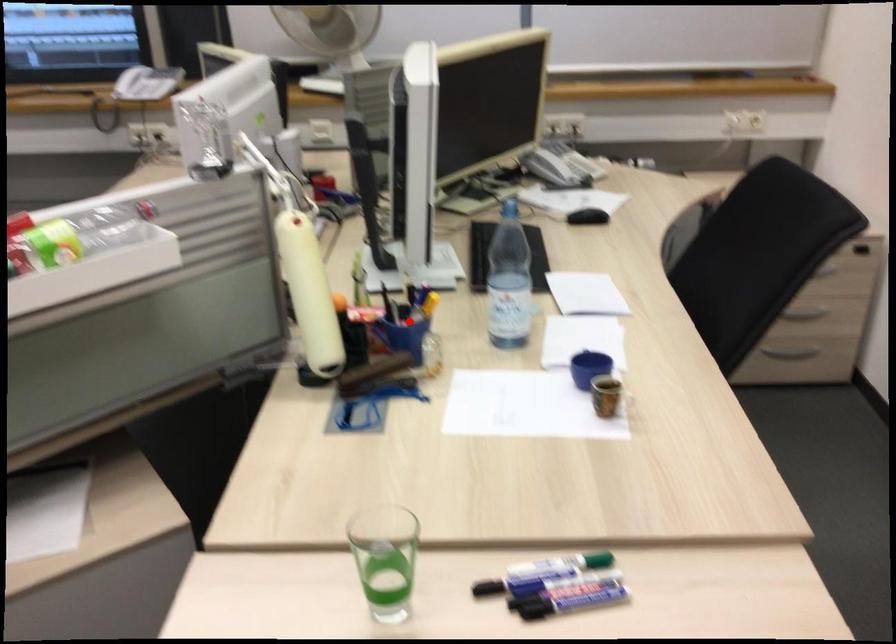
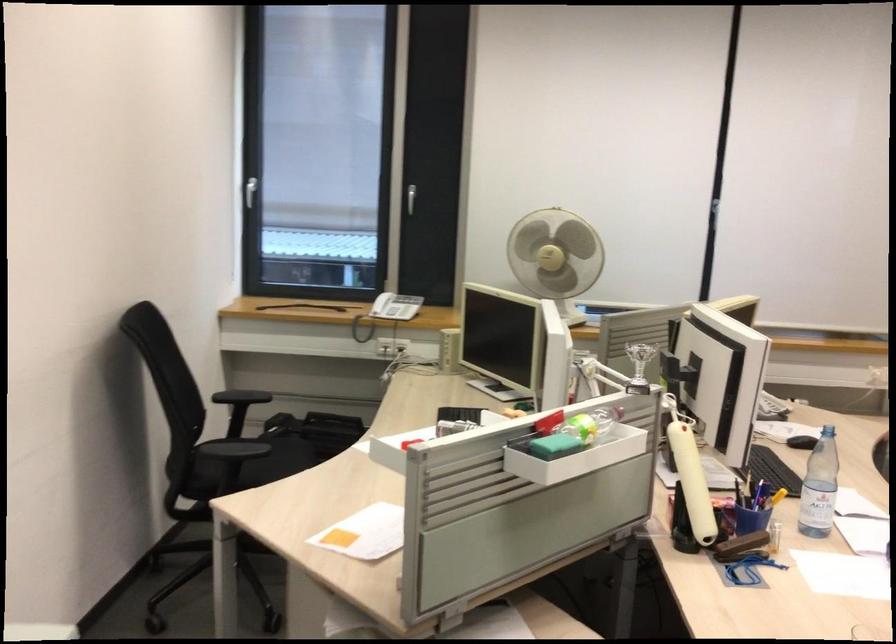
Find the pixel in the second image that matches the highlighted location in the first image.

(752, 507)